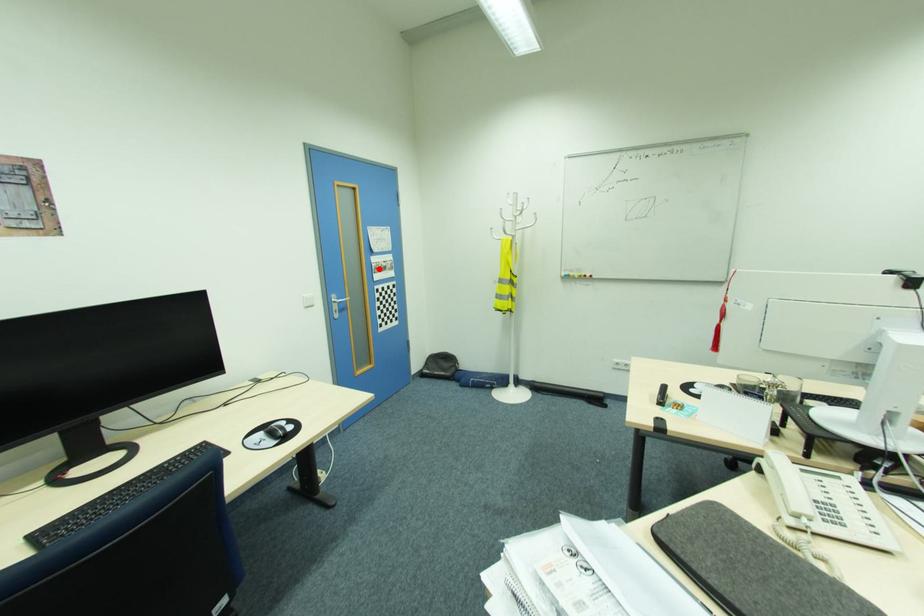
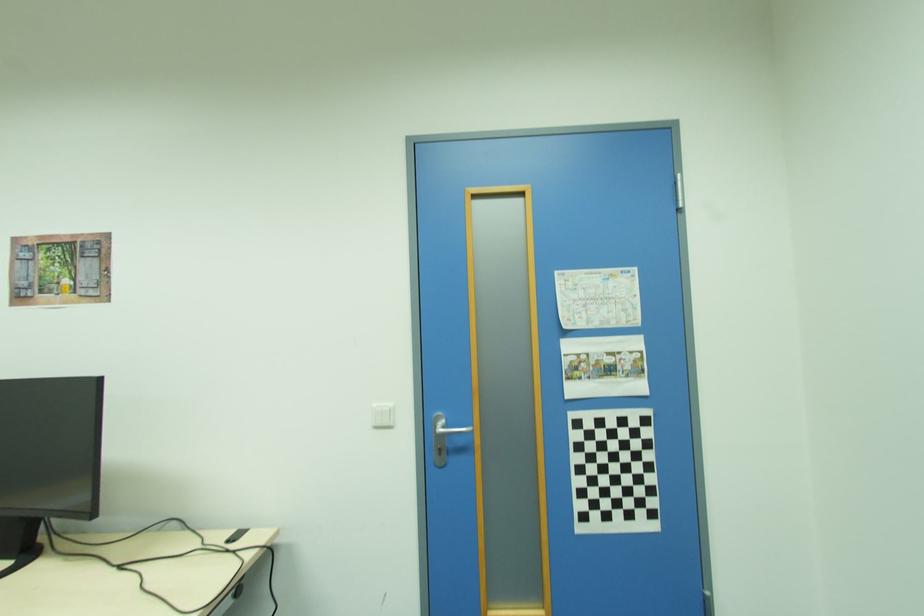
In the second image, find the point that corresponds to the highlighted location in the first image.

(579, 369)